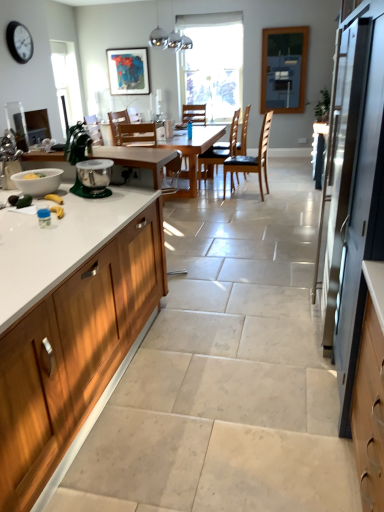
Question: From the image's perspective, would you say wooden cabinet at left is shown under wooden chair at center, the first chair positioned from the back?

Choices:
 (A) no
 (B) yes

Answer: (B)

Question: Is wooden cabinet at left thinner than wooden chair at center, arranged as the 5th chair when viewed from the front?

Choices:
 (A) yes
 (B) no

Answer: (B)

Question: Is wooden cabinet at left not inside wooden chair at center, arranged as the 5th chair when viewed from the front?

Choices:
 (A) no
 (B) yes

Answer: (B)

Question: Is wooden cabinet at left positioned with its back to wooden chair at center, the first chair positioned from the back?

Choices:
 (A) yes
 (B) no

Answer: (A)

Question: From a real-world perspective, is wooden cabinet at left positioned under wooden chair at center, arranged as the 5th chair when viewed from the front, based on gravity?

Choices:
 (A) no
 (B) yes

Answer: (B)

Question: Considering the relative sizes of wooden cabinet at left and wooden chair at center, arranged as the 5th chair when viewed from the front, in the image provided, is wooden cabinet at left shorter than wooden chair at center, arranged as the 5th chair when viewed from the front,?

Choices:
 (A) no
 (B) yes

Answer: (A)

Question: Is brown leather chair at center, the fourth chair viewed from the back, a part of clear glass window screen at upper right?

Choices:
 (A) no
 (B) yes

Answer: (A)

Question: From a real-world perspective, is clear glass window screen at upper right located beneath brown leather chair at center, the fourth chair viewed from the back?

Choices:
 (A) yes
 (B) no

Answer: (B)

Question: Is clear glass window screen at upper right positioned with its back to brown leather chair at center, arranged as the 2th chair when viewed from the front?

Choices:
 (A) no
 (B) yes

Answer: (A)

Question: Considering the relative sizes of clear glass window screen at upper right and brown leather chair at center, arranged as the 2th chair when viewed from the front, in the image provided, is clear glass window screen at upper right wider than brown leather chair at center, arranged as the 2th chair when viewed from the front,?

Choices:
 (A) yes
 (B) no

Answer: (B)

Question: Is clear glass window screen at upper right thinner than brown leather chair at center, arranged as the 2th chair when viewed from the front?

Choices:
 (A) yes
 (B) no

Answer: (A)

Question: Is clear glass window screen at upper right not close to brown leather chair at center, arranged as the 2th chair when viewed from the front?

Choices:
 (A) no
 (B) yes

Answer: (B)

Question: From a real-world perspective, is green plastic stand mixer at left located beneath satin silver refrigerator at right?

Choices:
 (A) yes
 (B) no

Answer: (B)